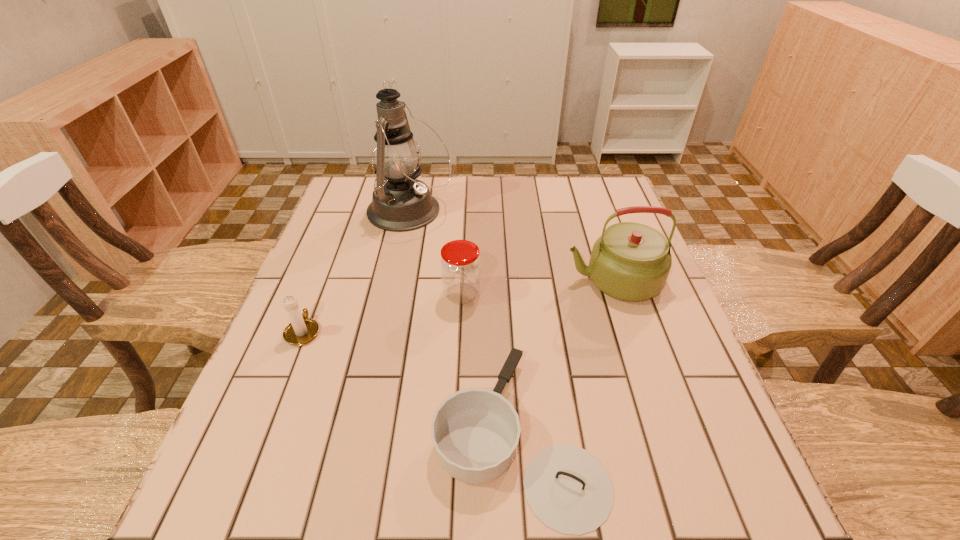
Locate an element on the screen. The width and height of the screenshot is (960, 540). vacant point located between the leftmost object and the jar is located at coordinates (382, 313).

The image size is (960, 540). I want to click on free spot between the saucepan and the farthest object, so click(464, 323).

The height and width of the screenshot is (540, 960). What are the coordinates of `vacant space that's between the tallest object and the shortest object` in the screenshot? It's located at [464, 323].

At what (x,y) coordinates should I click in order to perform the action: click on unoccupied area between the second shortest object and the second tallest object. Please return your answer as a coordinate pair (x, y). Looking at the image, I should click on (458, 306).

In order to click on free point between the second tallest object and the second shortest object in this screenshot , I will do `click(458, 306)`.

Where is `free space that is in between the candle holder and the shortest object`? Image resolution: width=960 pixels, height=540 pixels. free space that is in between the candle holder and the shortest object is located at coordinates tap(411, 383).

At what (x,y) coordinates should I click in order to perform the action: click on empty location between the fourth farthest object and the jar. Please return your answer as a coordinate pair (x, y). Looking at the image, I should click on (382, 313).

Where is `object identified as the second closest to the jar`? The image size is (960, 540). object identified as the second closest to the jar is located at coordinates (400, 202).

Identify which object is the fourth closest to the nearest object. Please provide its 2D coordinates. Your answer should be formatted as a tuple, i.e. [(x, y)], where the tuple contains the x and y coordinates of a point satisfying the conditions above.

[(400, 202)]

You are a GUI agent. You are given a task and a screenshot of the screen. Output one action in this format:
    pyautogui.click(x=<x>, y=<y>)
    Task: Click on the free space that satisfies the following two spatial constraints: 1. at the spout of the second tallest object; 2. on the front side of the jar
    This screenshot has width=960, height=540.
    Given the screenshot: What is the action you would take?
    pyautogui.click(x=618, y=294)